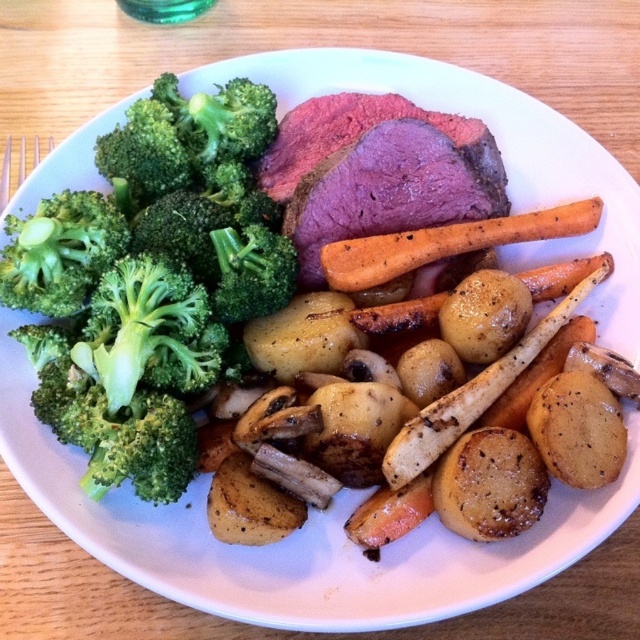
Question: From the image, what is the correct spatial relationship of green fresh broccoli at left in relation to pinkish-brown meat at upper center?

Choices:
 (A) below
 (B) above

Answer: (A)

Question: Among these points, which one is nearest to the camera?

Choices:
 (A) (324, 100)
 (B) (438, 256)

Answer: (B)

Question: Which object appears farthest from the camera in this image?

Choices:
 (A) brown crispy potato at center-right
 (B) orange glazed carrot at center
 (C) golden-brown roasted carrot at center-right
 (D) pinkish-brown meat at upper center

Answer: (D)

Question: Does green fresh broccoli at left have a greater width compared to orange glazed carrot at center?

Choices:
 (A) yes
 (B) no

Answer: (B)

Question: Is green fresh broccoli at left to the right of orange glazed carrot at center from the viewer's perspective?

Choices:
 (A) no
 (B) yes

Answer: (A)

Question: Which of the following is the farthest from the observer?

Choices:
 (A) (577, 467)
 (B) (545, 211)
 (C) (22, 141)
 (D) (108, 275)

Answer: (C)